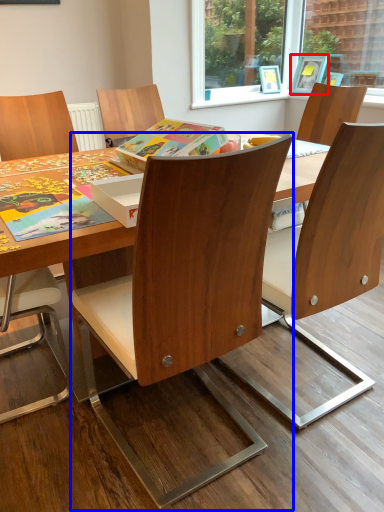
Question: Which point is further to the camera, picture frame (highlighted by a red box) or chair (highlighted by a blue box)?

Choices:
 (A) picture frame
 (B) chair

Answer: (A)